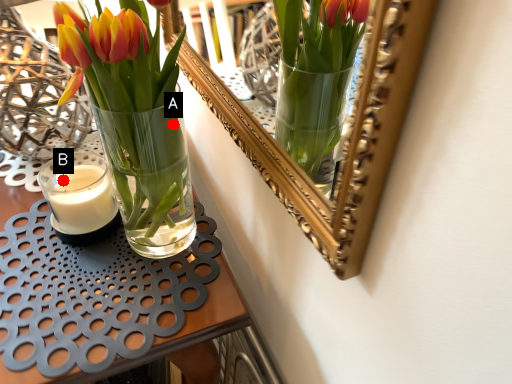
Question: Two points are circled on the image, labeled by A and B beside each circle. Which point is farther to the camera?

Choices:
 (A) A is further
 (B) B is further

Answer: (B)